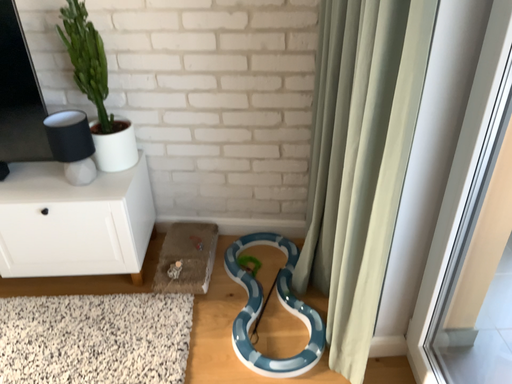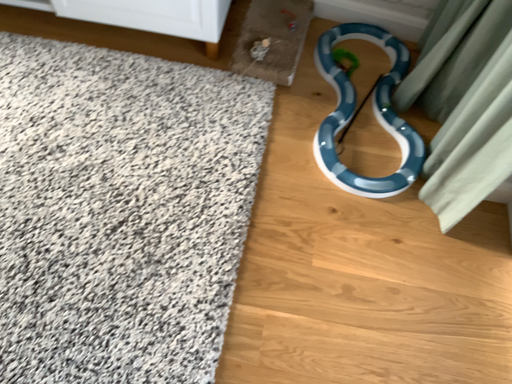
Question: Which way did the camera rotate in the video?

Choices:
 (A) rotated left
 (B) rotated right

Answer: (A)